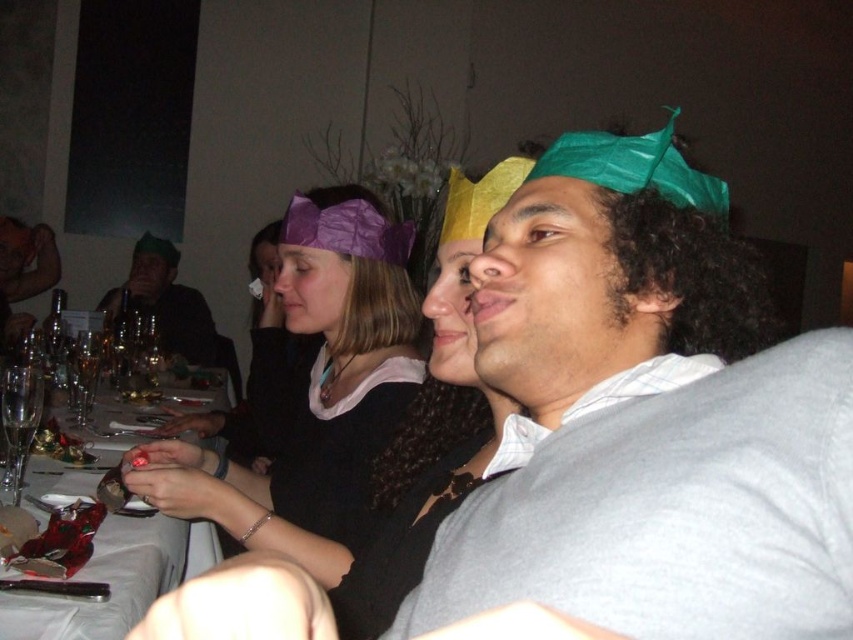
You are at a party and want to grab a drink. There are two clear glass wine glasses in your view. Which one, the clear glass wine glass at lower left or the clear glass wine glass at left, is closer to you?

The clear glass wine glass at lower left is closer to you because it is in front of the clear glass wine glass at left.

You are a photographer standing at the camera position. You want to capture a closeup shot of the clear glass wine glass at lower left without moving the glass. Can you reach the glass from your current position to adjust it for a better shot?

The clear glass wine glass at lower left and camera are 1.26 meters apart, so you can reach the glass from your current position to adjust it for a better shot since the distance is within arm reach.